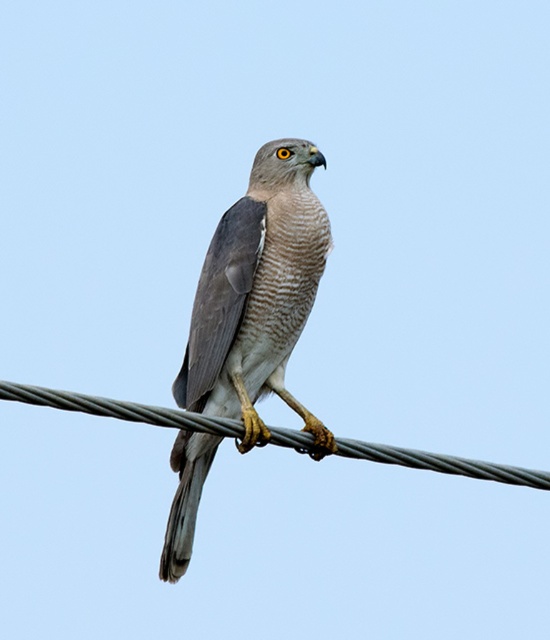
Question: Is gray feathered falcon at center further to the viewer compared to black wire at center?

Choices:
 (A) no
 (B) yes

Answer: (B)

Question: Among these points, which one is nearest to the camera?

Choices:
 (A) (233, 428)
 (B) (316, 209)

Answer: (A)

Question: Is gray feathered falcon at center positioned behind black wire at center?

Choices:
 (A) yes
 (B) no

Answer: (A)

Question: Which of the following is the farthest from the observer?

Choices:
 (A) gray feathered falcon at center
 (B) black wire at center

Answer: (A)

Question: Is gray feathered falcon at center closer to the viewer compared to black wire at center?

Choices:
 (A) yes
 (B) no

Answer: (B)